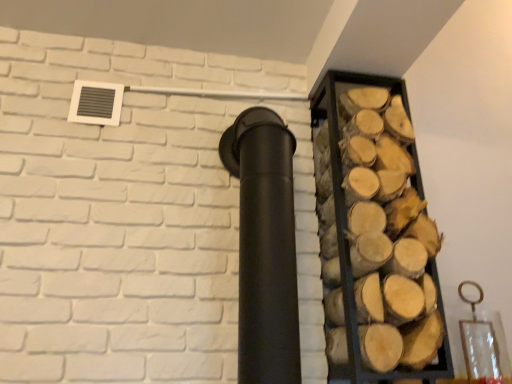
Where is `wooden logs at right`? The image size is (512, 384). wooden logs at right is located at coordinates (367, 225).

Describe the element at coordinates (367, 225) in the screenshot. I see `wooden logs at right` at that location.

Identify the location of wooden logs at right. Image resolution: width=512 pixels, height=384 pixels. (367, 225).